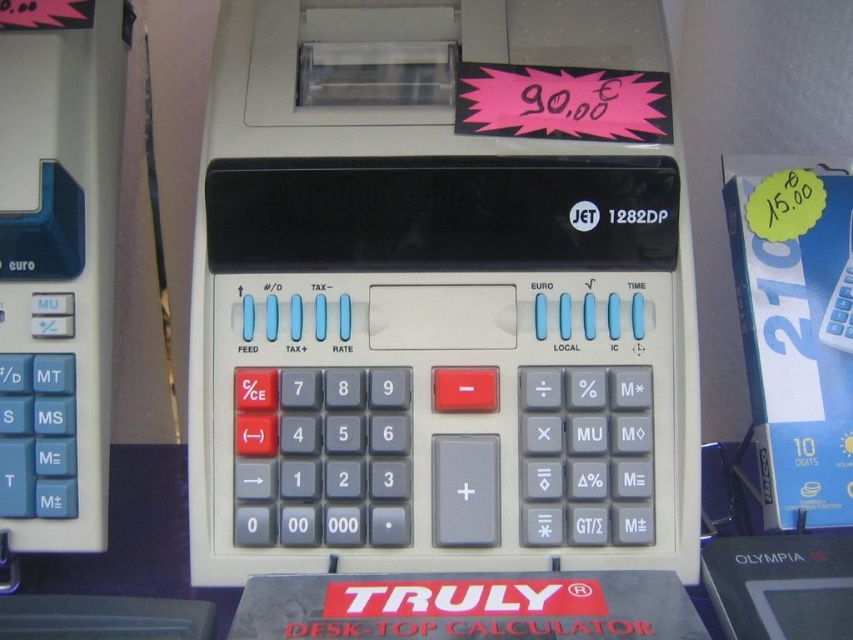
Can you confirm if beige plastic calculator at center is smaller than white plastic calculator at center?

Actually, beige plastic calculator at center might be larger than white plastic calculator at center.

Is beige plastic calculator at center wider than white plastic calculator at center?

Correct, the width of beige plastic calculator at center exceeds that of white plastic calculator at center.

Is point (242, 531) closer to viewer compared to point (844, 346)?

That is True.

The image size is (853, 640). I want to click on beige plastic calculator at center, so click(x=437, y=301).